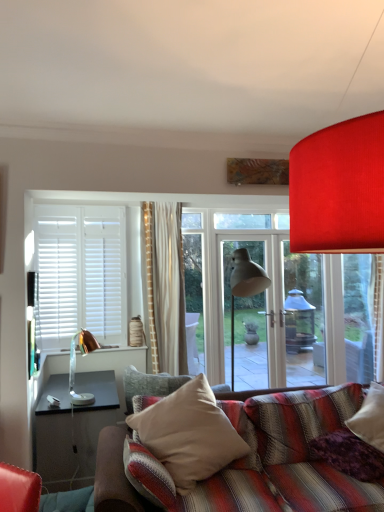
Question: Considering the relative sizes of purple soft pillow at lower right, the second pillow from the left, and beige fabric pillow at center, marked as the 2th pillow in a right-to-left arrangement, in the image provided, is purple soft pillow at lower right, the second pillow from the left, bigger than beige fabric pillow at center, marked as the 2th pillow in a right-to-left arrangement,?

Choices:
 (A) no
 (B) yes

Answer: (A)

Question: Is the position of purple soft pillow at lower right, which appears as the first pillow when viewed from the right, less distant than that of beige fabric pillow at center, which is the 1th pillow in left-to-right order?

Choices:
 (A) yes
 (B) no

Answer: (B)

Question: Considering the relative positions of purple soft pillow at lower right, which appears as the first pillow when viewed from the right, and beige fabric pillow at center, which is the 1th pillow in left-to-right order, in the image provided, is purple soft pillow at lower right, which appears as the first pillow when viewed from the right, behind beige fabric pillow at center, which is the 1th pillow in left-to-right order,?

Choices:
 (A) no
 (B) yes

Answer: (B)

Question: Is purple soft pillow at lower right, the second pillow from the left, positioned beyond the bounds of beige fabric pillow at center, which is the 1th pillow in left-to-right order?

Choices:
 (A) no
 (B) yes

Answer: (B)

Question: Is purple soft pillow at lower right, which appears as the first pillow when viewed from the right, to the left of beige fabric pillow at center, marked as the 2th pillow in a right-to-left arrangement, from the viewer's perspective?

Choices:
 (A) no
 (B) yes

Answer: (A)

Question: Is point (183, 485) positioned closer to the camera than point (72, 394)?

Choices:
 (A) farther
 (B) closer

Answer: (B)

Question: Is beige fabric pillow at center, marked as the 2th pillow in a right-to-left arrangement, situated inside copper metallic table lamp at left or outside?

Choices:
 (A) inside
 (B) outside

Answer: (B)

Question: Is beige fabric pillow at center, which is the 1th pillow in left-to-right order, in front of or behind copper metallic table lamp at left in the image?

Choices:
 (A) behind
 (B) front

Answer: (B)

Question: From the image's perspective, relative to copper metallic table lamp at left, is beige fabric pillow at center, which is the 1th pillow in left-to-right order, above or below?

Choices:
 (A) below
 (B) above

Answer: (A)

Question: Which is correct: purple soft pillow at lower right, the second pillow from the left, is inside beige fabric pillow at center, marked as the 2th pillow in a right-to-left arrangement, or outside of it?

Choices:
 (A) outside
 (B) inside

Answer: (A)

Question: Is point (370, 473) closer or farther from the camera than point (142, 416)?

Choices:
 (A) farther
 (B) closer

Answer: (B)

Question: Is purple soft pillow at lower right, which appears as the first pillow when viewed from the right, to the left or to the right of beige fabric pillow at center, marked as the 2th pillow in a right-to-left arrangement, in the image?

Choices:
 (A) left
 (B) right

Answer: (B)

Question: Is purple soft pillow at lower right, which appears as the first pillow when viewed from the right, bigger or smaller than beige fabric pillow at center, which is the 1th pillow in left-to-right order?

Choices:
 (A) small
 (B) big

Answer: (A)

Question: Is point (157, 404) positioned closer to the camera than point (375, 464)?

Choices:
 (A) farther
 (B) closer

Answer: (A)

Question: Considering their positions, is beige fabric pillow at center, which is the 1th pillow in left-to-right order, located in front of or behind purple soft pillow at lower right, the second pillow from the left?

Choices:
 (A) behind
 (B) front

Answer: (B)